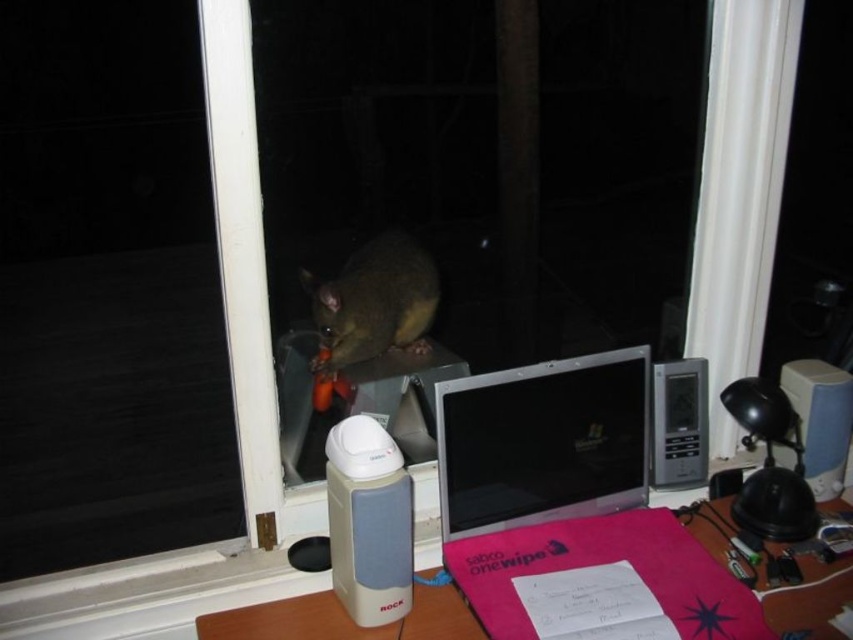
You are organizing items on the desk and want to place a new item between the white plastic speaker at lower left and the brown furry possum at center. Is there enough space for the new item?

The white plastic speaker at lower left is to the left of the brown furry possum at center, so there is space between them to place a new item.

You are organizing items on a desk. You have a silver metallic laptop at center and a white plastic speaker at lower left. According to their positions, which item is placed on top of the other?

The silver metallic laptop at center is positioned over the white plastic speaker at lower left, so the laptop is placed on top of the speaker.

You are organizing items on a desk and need to place the silver metallic laptop at center and the beige plastic speaker at lower center. According to the scene, which item is placed on top of the other?

The silver metallic laptop at center is positioned over beige plastic speaker at lower center, meaning the laptop is placed on top of the speaker.